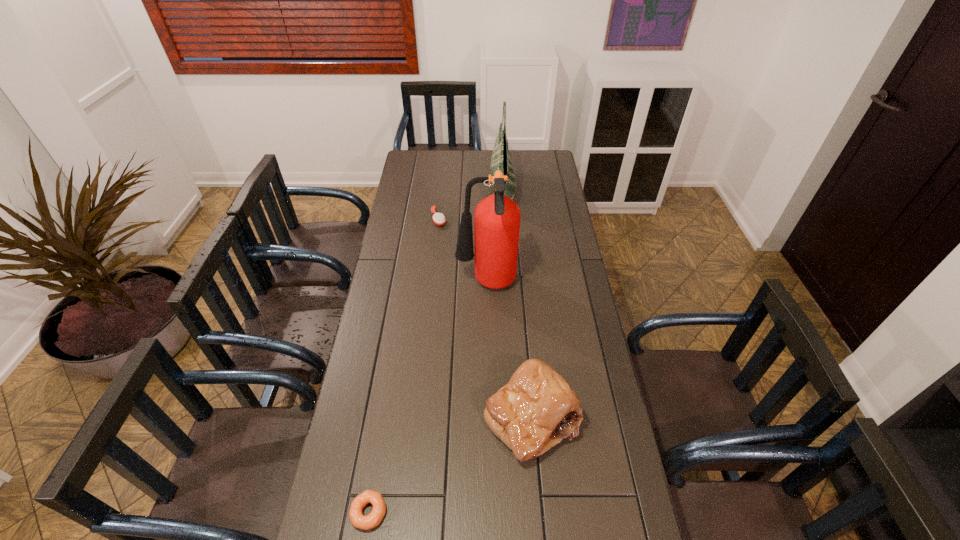
Where is `free space located 0.150m on the right of the tote bag`? The image size is (960, 540). free space located 0.150m on the right of the tote bag is located at coordinates (545, 192).

Identify the location of blank area located on the filling side of the third tallest object. (542, 535).

Locate an element on the screen. vacant point located on the back of the hairbrush is located at coordinates (444, 178).

At what (x,y) coordinates should I click in order to perform the action: click on free region located on the right of the leftmost object. Please return your answer as a coordinate pair (x, y). The width and height of the screenshot is (960, 540). Looking at the image, I should click on (509, 512).

You are a GUI agent. You are given a task and a screenshot of the screen. Output one action in this format:
    pyautogui.click(x=<x>, y=<y>)
    Task: Click on the object present at the far edge
    
    Given the screenshot: What is the action you would take?
    pos(500,160)

Locate an element on the screen. The image size is (960, 540). object located at the left edge is located at coordinates (373, 519).

Locate an element on the screen. This screenshot has width=960, height=540. object that is at the right edge is located at coordinates (537, 409).

I want to click on vacant space at the far edge, so click(464, 165).

This screenshot has width=960, height=540. In the image, there is a desktop. In order to click on vacant space at the left edge in this screenshot , I will do `click(357, 391)`.

In the image, there is a desktop. At what (x,y) coordinates should I click in order to perform the action: click on vacant area at the right edge. Please return your answer as a coordinate pair (x, y). The image size is (960, 540). Looking at the image, I should click on (574, 455).